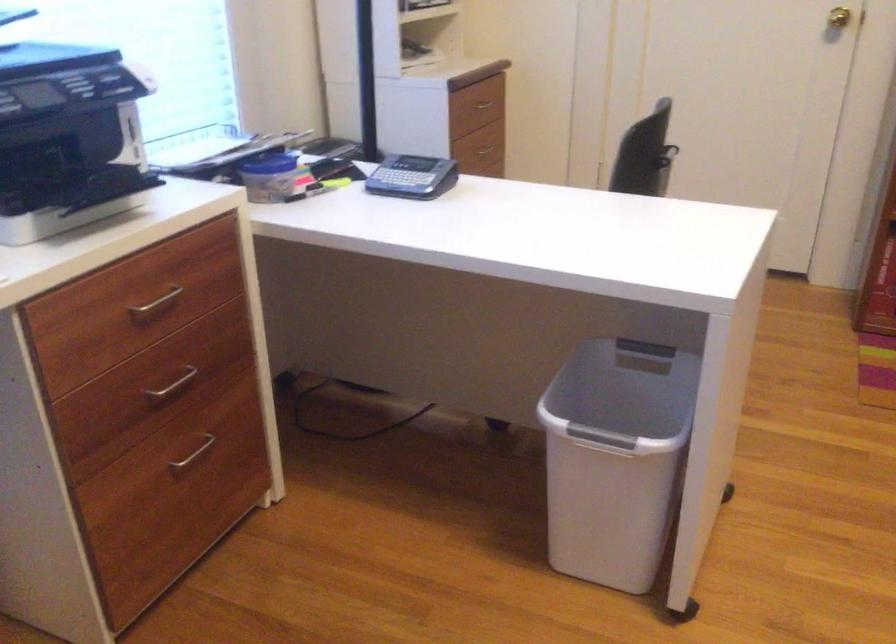
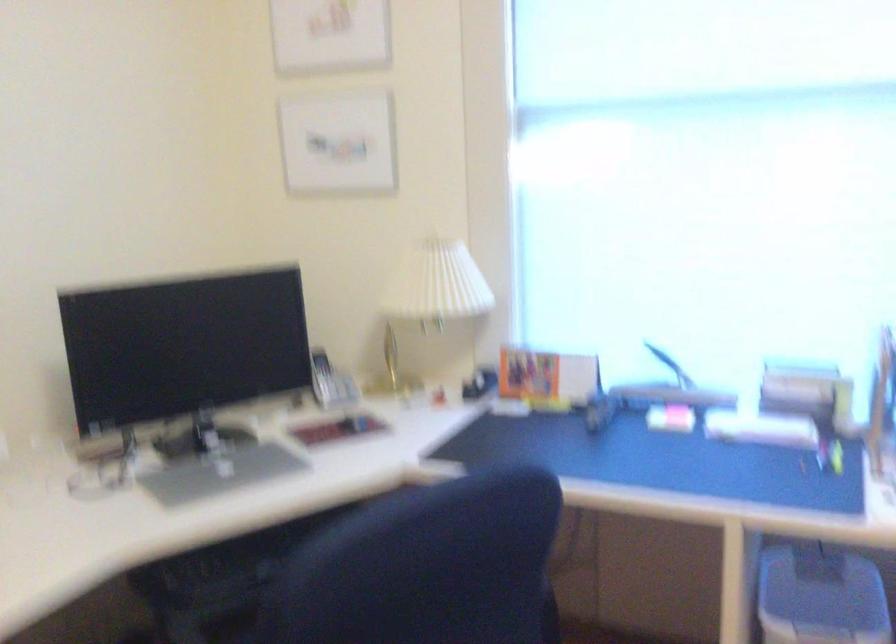
Question: How did the camera likely rotate?

Choices:
 (A) Left
 (B) Right
 (C) Up
 (D) Down

Answer: (A)